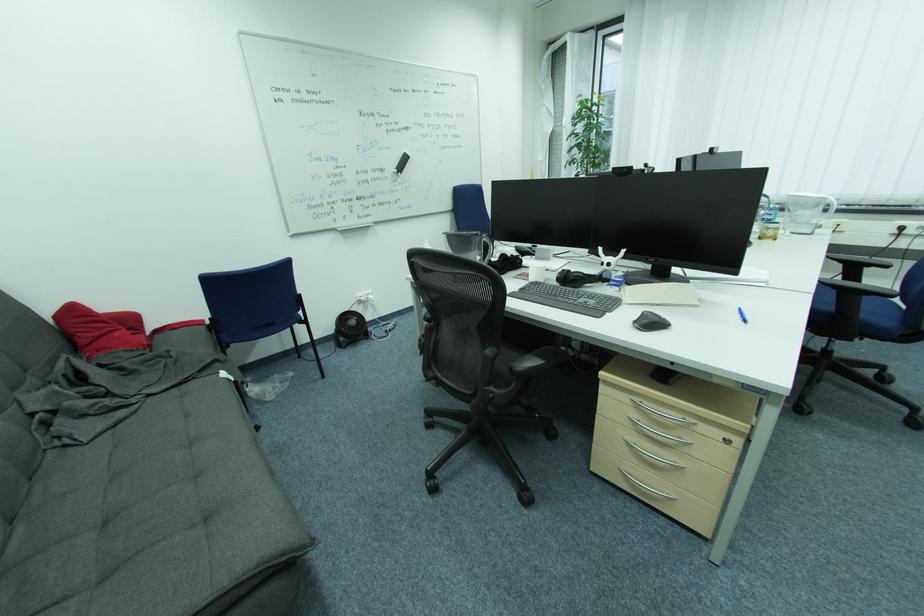
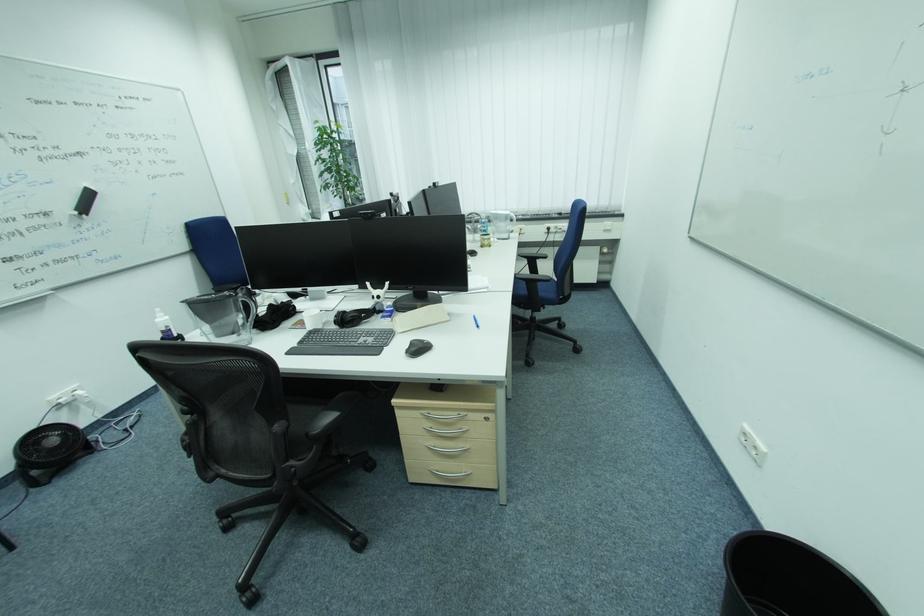
The point at (359, 323) is marked in the first image. Where is the corresponding point in the second image?

(59, 442)